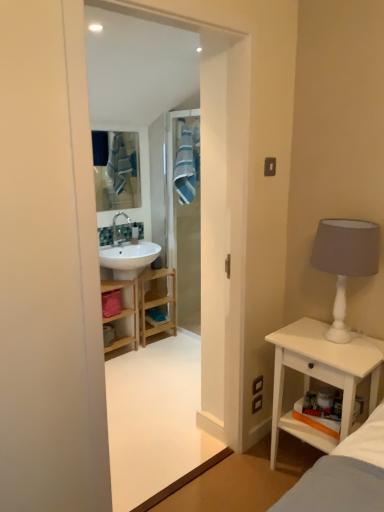
Question: Considering the relative positions of white matte table lamp at right and wooden cabinet at center in the image provided, is white matte table lamp at right behind wooden cabinet at center?

Choices:
 (A) yes
 (B) no

Answer: (B)

Question: From a real-world perspective, is white matte table lamp at right on top of wooden cabinet at center?

Choices:
 (A) no
 (B) yes

Answer: (B)

Question: From the image's perspective, is white matte table lamp at right on wooden cabinet at center?

Choices:
 (A) no
 (B) yes

Answer: (B)

Question: From a real-world perspective, is white matte table lamp at right physically below wooden cabinet at center?

Choices:
 (A) yes
 (B) no

Answer: (B)

Question: Can you confirm if white matte table lamp at right is shorter than wooden cabinet at center?

Choices:
 (A) yes
 (B) no

Answer: (A)

Question: Is white matte table lamp at right next to wooden cabinet at center and touching it?

Choices:
 (A) yes
 (B) no

Answer: (B)

Question: Is white matte table lamp at right wider than white wood nightstand at right?

Choices:
 (A) no
 (B) yes

Answer: (A)

Question: From a real-world perspective, does white matte table lamp at right sit lower than white wood nightstand at right?

Choices:
 (A) no
 (B) yes

Answer: (A)

Question: Is white matte table lamp at right taller than white wood nightstand at right?

Choices:
 (A) no
 (B) yes

Answer: (A)

Question: Is white matte table lamp at right at the right side of white wood nightstand at right?

Choices:
 (A) yes
 (B) no

Answer: (A)

Question: Is white matte table lamp at right next to white wood nightstand at right?

Choices:
 (A) yes
 (B) no

Answer: (B)

Question: Would you consider white matte table lamp at right to be distant from white wood nightstand at right?

Choices:
 (A) yes
 (B) no

Answer: (B)

Question: Considering the relative sizes of blue fabric mirror at upper center and white glossy sink at upper left in the image provided, is blue fabric mirror at upper center taller than white glossy sink at upper left?

Choices:
 (A) yes
 (B) no

Answer: (A)